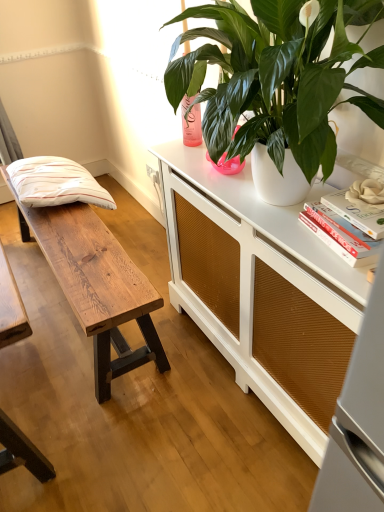
In order to click on empty space that is ontop of wooden bench at left in this screenshot , I will do `click(73, 240)`.